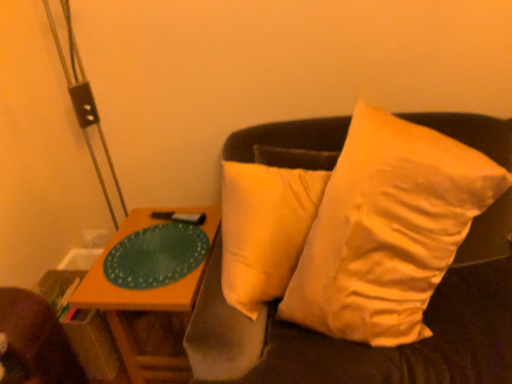
Question: Is white soft pillow at upper right inside the boundaries of green matte glass plate at left, or outside?

Choices:
 (A) outside
 (B) inside

Answer: (A)

Question: In terms of width, does white soft pillow at upper right look wider or thinner when compared to green matte glass plate at left?

Choices:
 (A) wide
 (B) thin

Answer: (A)

Question: Estimate the real-world distances between objects in this image. Which object is farther from the white soft pillow at upper right?

Choices:
 (A) wooden table at left
 (B) green matte glass plate at left

Answer: (A)

Question: Considering the real-world distances, which object is closest to the green matte glass plate at left?

Choices:
 (A) wooden table at left
 (B) white soft pillow at upper right

Answer: (A)